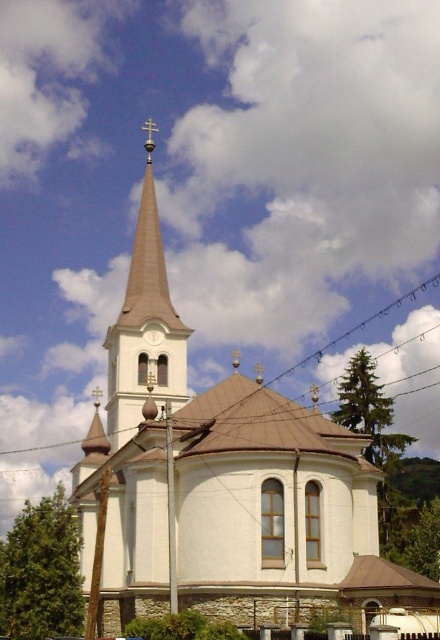
Where is `white stone church at center`? The image size is (440, 640). white stone church at center is located at coordinates (220, 481).

Which is below, white stone church at center or white stucco tower at upper center?

Positioned lower is white stone church at center.

What do you see at coordinates (220, 481) in the screenshot? The height and width of the screenshot is (640, 440). I see `white stone church at center` at bounding box center [220, 481].

Image resolution: width=440 pixels, height=640 pixels. I want to click on white stone church at center, so tap(220, 481).

Is white stone church at center taller than white metallic clock at upper center?

Correct, white stone church at center is much taller as white metallic clock at upper center.

Is point (113, 419) positioned before point (157, 339)?

No, it is behind (157, 339).

What do you see at coordinates (220, 481) in the screenshot? I see `white stone church at center` at bounding box center [220, 481].

In order to click on white stone church at center in this screenshot , I will do `click(220, 481)`.

From the picture: Is white stucco tower at upper center positioned before white metallic clock at upper center?

That is True.

Does white stucco tower at upper center appear under white metallic clock at upper center?

No.

Is point (164, 296) behind point (147, 337)?

Yes.

The width and height of the screenshot is (440, 640). Find the location of `white stucco tower at upper center`. white stucco tower at upper center is located at coordinates (145, 328).